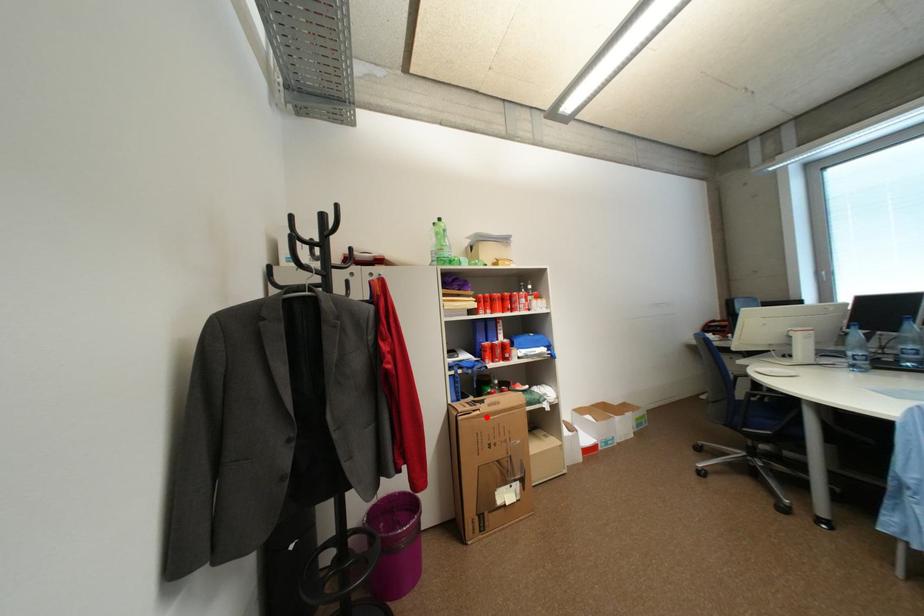
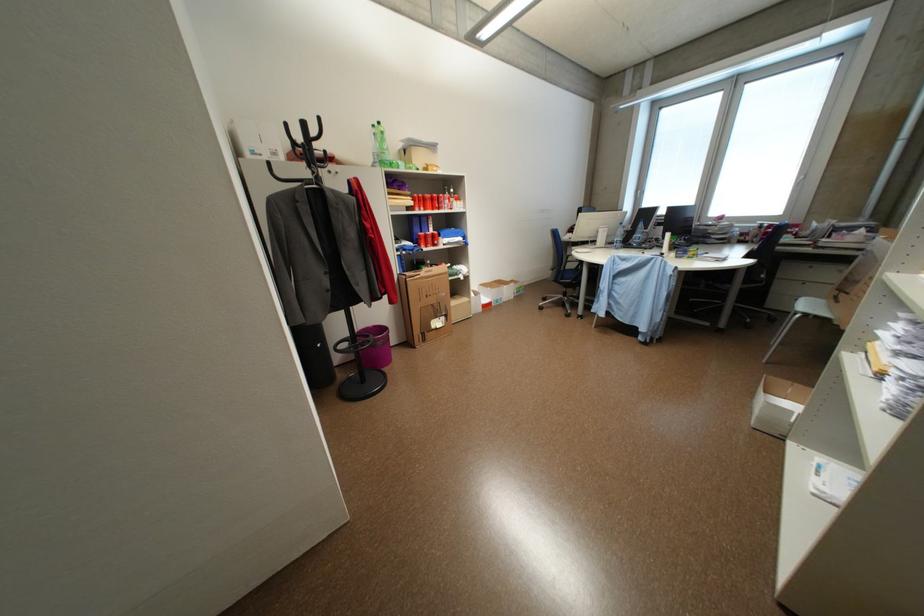
Where in the second image is the point corresponding to the highlighted location from the first image?

(428, 280)